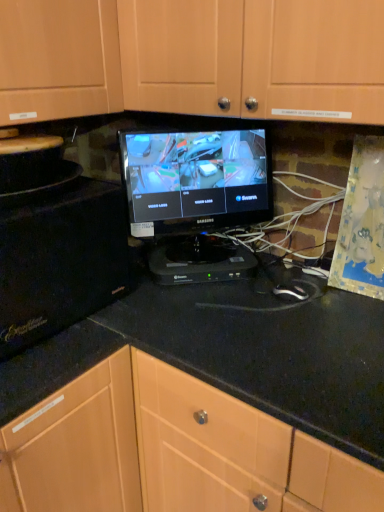
This screenshot has width=384, height=512. Identify the location of vacant space in front of black plastic mouse at center. (301, 329).